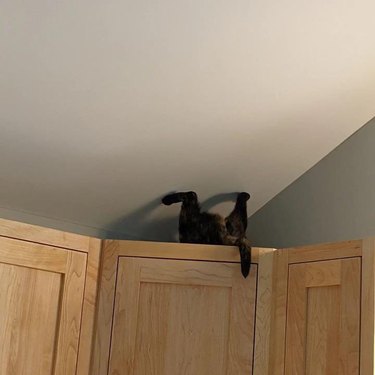
Identify the location of white ceiling. This screenshot has width=375, height=375. (215, 96).